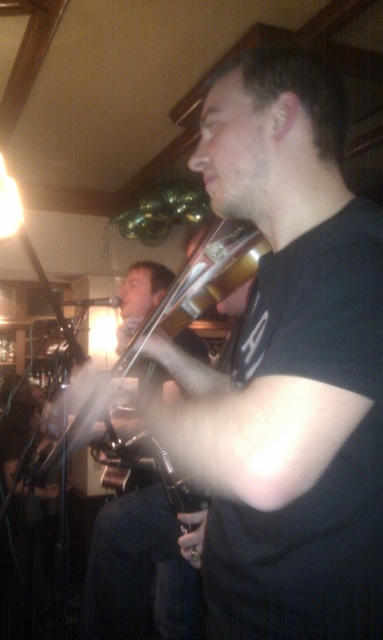
In the scene shown: You are a photographer standing in the venue and want to take a clear photo of the shiny silver cello at center without any motion blur. The camera you have requires a minimum distance of 4 feet to avoid blur. Can you take the photo without moving closer?

The shiny silver cello at center and viewer are 4.17 feet apart from each other. Since 4.17 feet is greater than the required 4 feet, you can take the photo without moving closer.

You are a photographer at the back of the venue and want to take a photo of both the shiny silver cello at center and the shiny silver violin at center. Which instrument should you adjust your camera focus on first to ensure both are in the frame?

The shiny silver violin at center is behind the shiny silver cello at center, so you should focus on the shiny silver violin at center first to ensure both are in focus.

You are a photographer at the live music performance. You want to capture a photo where the shiny silver cello at center and the shiny silver violin at center are both clearly visible. Given their positions, which one should you focus on first to ensure both are in frame?

The shiny silver cello at center is located below the shiny silver violin at center, so you should focus on the shiny silver violin at center first to ensure both are in frame.